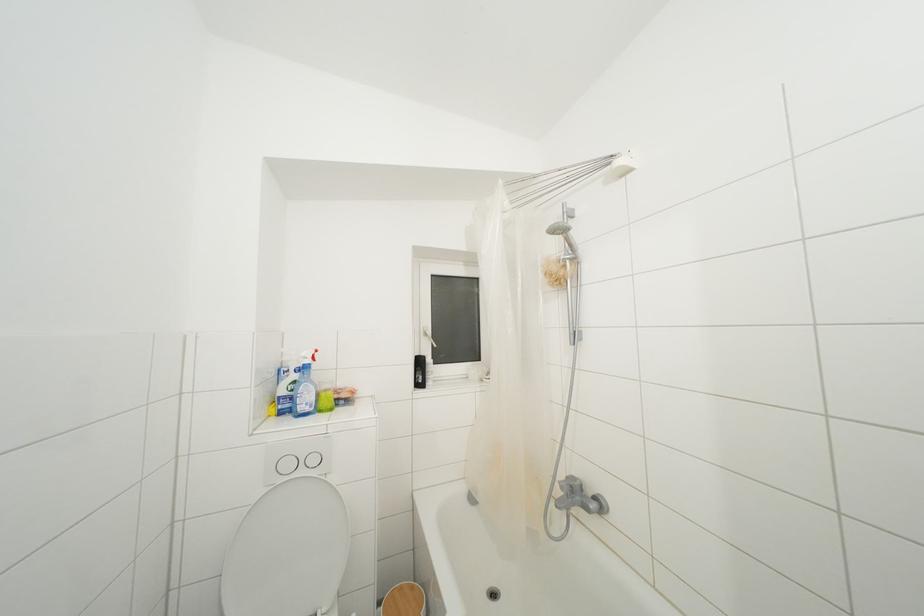
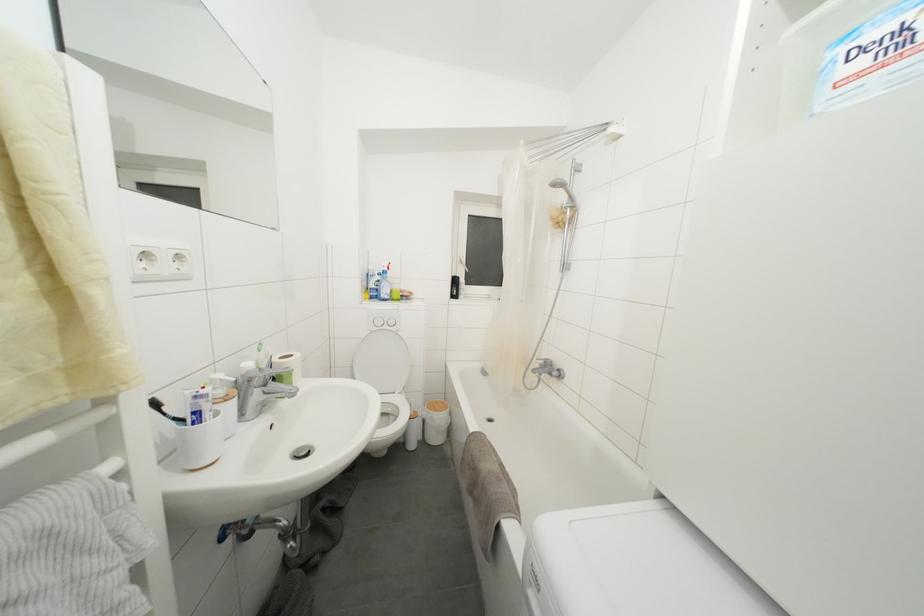
Find the pixel in the second image that matches the point at 290,411 in the first image.

(379, 300)